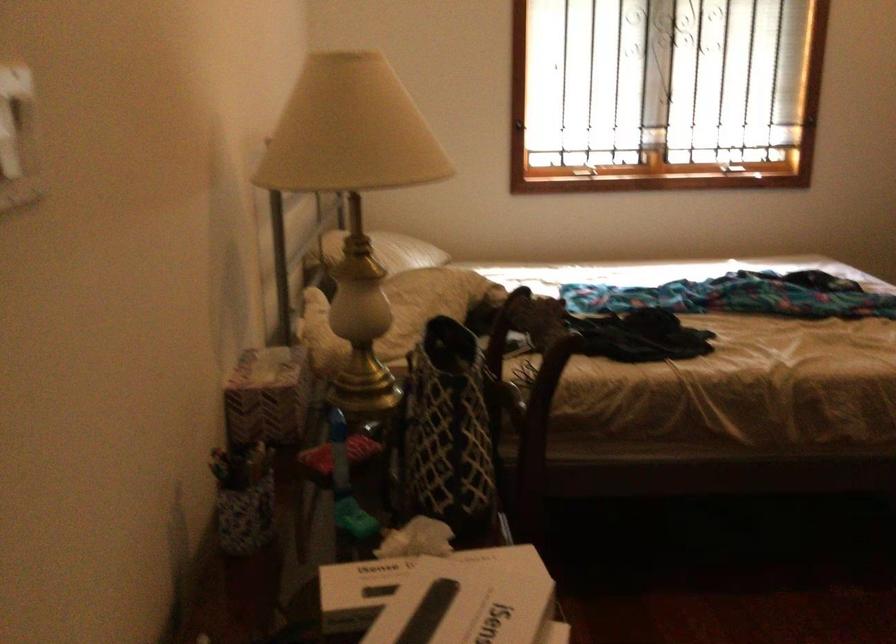
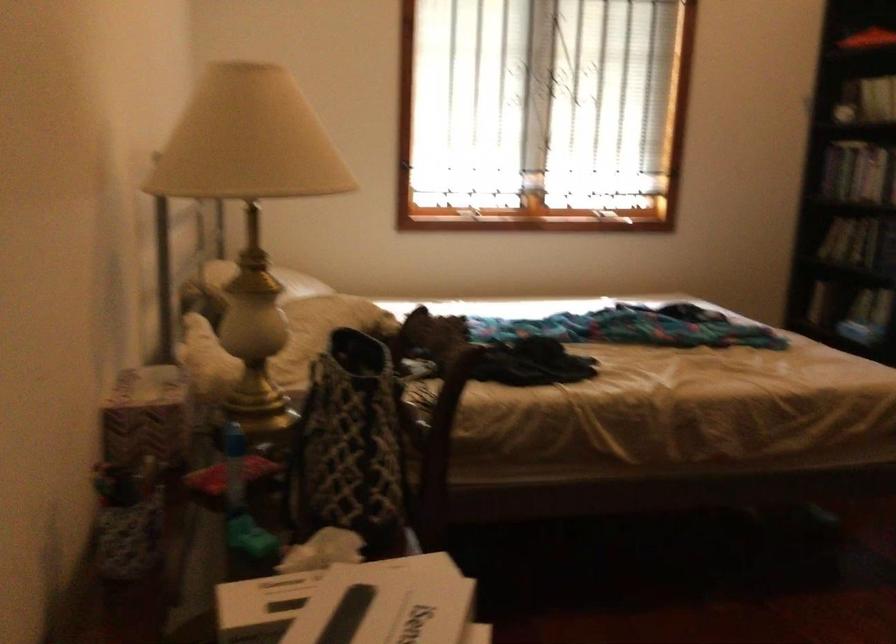
What movement of the cameraman would produce the second image?

The cameraman walked toward left, forward.